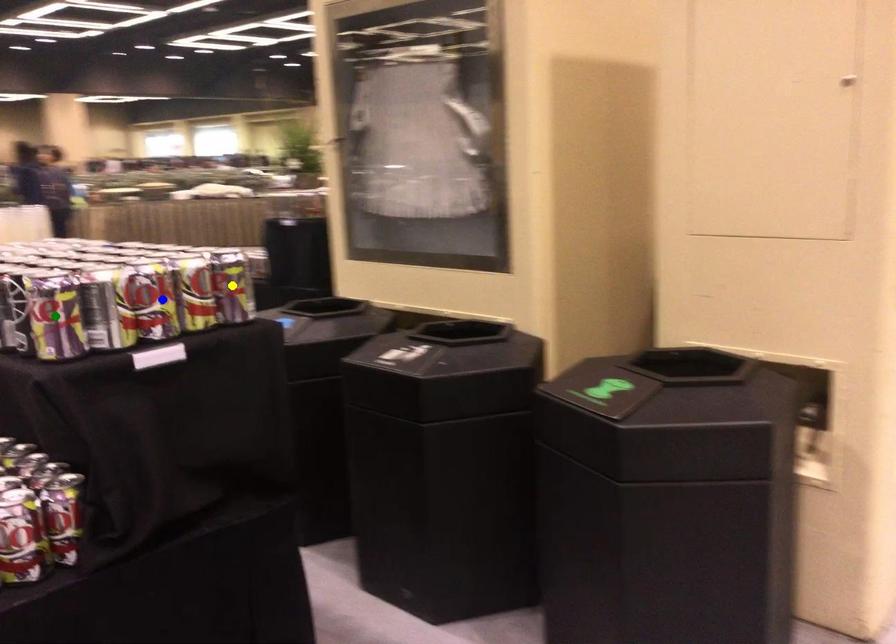
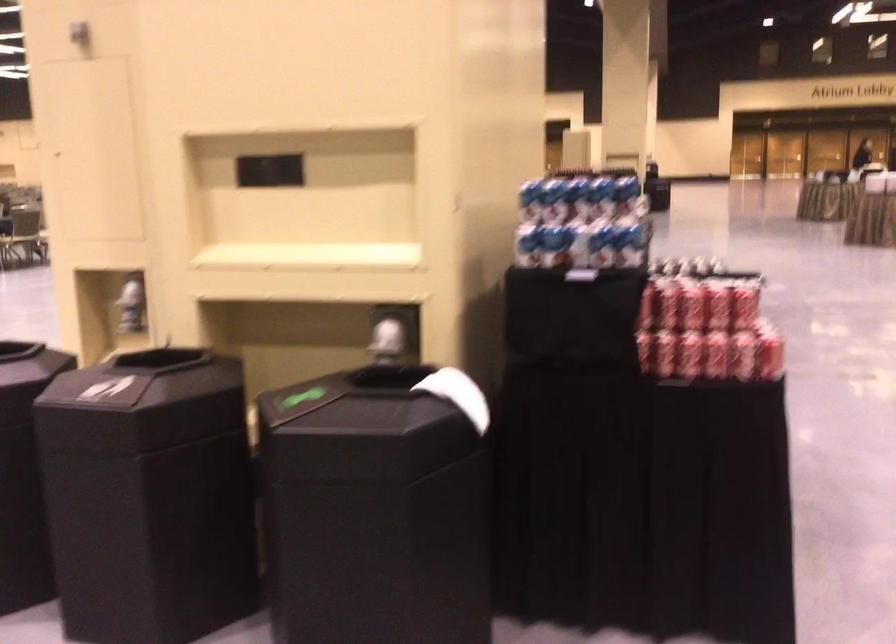
I am providing you with two images of the same scene from different viewpoints. Three points are marked in image1. Which point corresponds to a part or object that is occluded in image2?In image1, three points are marked. Which of them correspond to a part or object that is occluded in image2?Among the three points shown in image1, which one corresponds to a part or object that is no longer visible due to occlusion in image2?

green point, blue point, yellow point cannot be seen in image2.